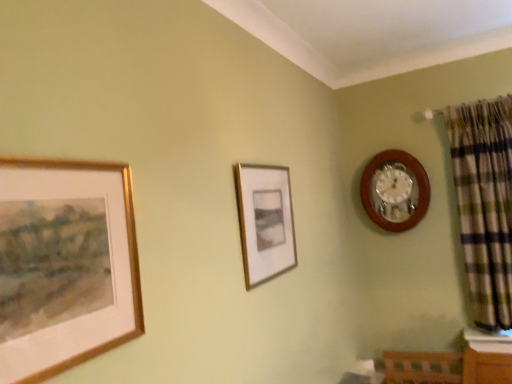
Question: Can you confirm if wooden wall clock at upper right is positioned to the left of green plaid fabric at right?

Choices:
 (A) no
 (B) yes

Answer: (B)

Question: Is wooden wall clock at upper right not inside green plaid fabric at right?

Choices:
 (A) yes
 (B) no

Answer: (A)

Question: Does wooden wall clock at upper right have a smaller size compared to green plaid fabric at right?

Choices:
 (A) no
 (B) yes

Answer: (B)

Question: From the image's perspective, does wooden wall clock at upper right appear higher than green plaid fabric at right?

Choices:
 (A) no
 (B) yes

Answer: (B)

Question: Is wooden wall clock at upper right at the right side of green plaid fabric at right?

Choices:
 (A) no
 (B) yes

Answer: (A)

Question: From a real-world perspective, does wooden wall clock at upper right stand above green plaid fabric at right?

Choices:
 (A) no
 (B) yes

Answer: (B)

Question: Is wooden wall clock at upper right at the left side of gold-framed painting at left, which is the second picture frame from back to front?

Choices:
 (A) no
 (B) yes

Answer: (A)

Question: Does wooden wall clock at upper right appear on the right side of gold-framed painting at left, which is the second picture frame from back to front?

Choices:
 (A) no
 (B) yes

Answer: (B)

Question: Is gold-framed painting at left, the 1th picture frame when ordered from left to right, at the back of wooden wall clock at upper right?

Choices:
 (A) yes
 (B) no

Answer: (B)

Question: From a real-world perspective, is wooden wall clock at upper right beneath gold-framed painting at left, which ranks as the 1th picture frame in front-to-back order?

Choices:
 (A) no
 (B) yes

Answer: (A)

Question: Is wooden wall clock at upper right outside of gold-framed painting at left, the second picture frame in the right-to-left sequence?

Choices:
 (A) no
 (B) yes

Answer: (B)

Question: Is wooden wall clock at upper right further to the viewer compared to gold-framed painting at left, which is the second picture frame from back to front?

Choices:
 (A) yes
 (B) no

Answer: (A)

Question: Is matte gold picture frame at center, arranged as the 2th picture frame when viewed from the front, positioned in front of gold-framed painting at left, which is the second picture frame from back to front?

Choices:
 (A) yes
 (B) no

Answer: (B)